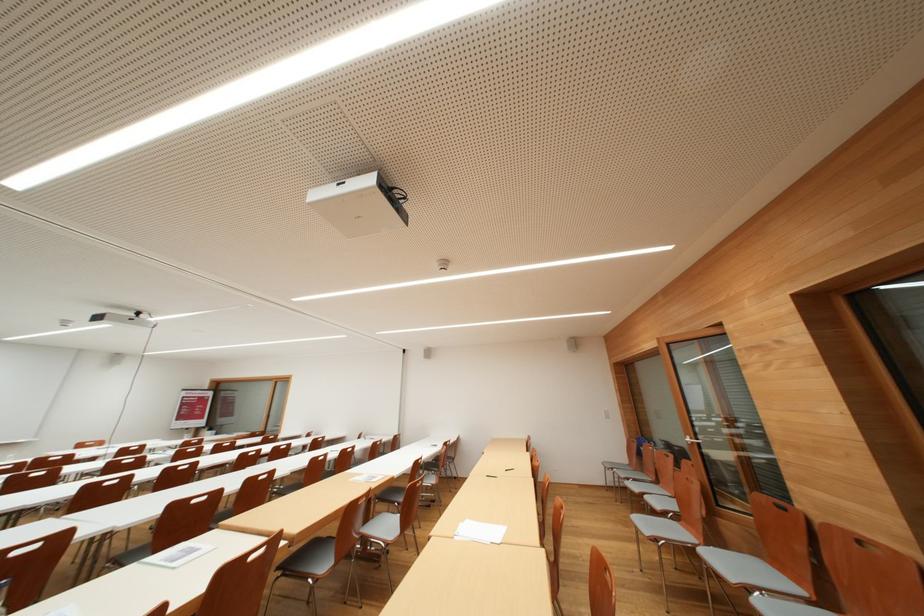
Where would you lift the black pen? Please return your answer as a coordinate pair (x, y).

(491, 476)